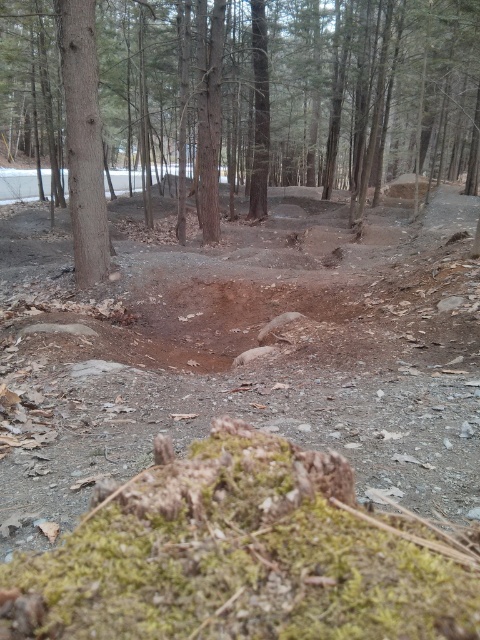
Question: Which point appears closest to the camera in this image?

Choices:
 (A) (259, 42)
 (B) (64, 74)
 (C) (384, 390)

Answer: (C)

Question: Is brown dirt track at center above brown rough tree trunk at left?

Choices:
 (A) yes
 (B) no

Answer: (B)

Question: Which object appears farthest from the camera in this image?

Choices:
 (A) brown dirt track at center
 (B) brown rough tree trunk at left

Answer: (B)

Question: Which is farther from the brown dirt track at center?

Choices:
 (A) brown textured dirt at center
 (B) brown rough tree trunk at left

Answer: (A)

Question: Does brown dirt track at center appear under brown rough tree trunk at left?

Choices:
 (A) yes
 (B) no

Answer: (A)

Question: Is brown textured dirt at center above brown dirt track at center?

Choices:
 (A) yes
 (B) no

Answer: (A)